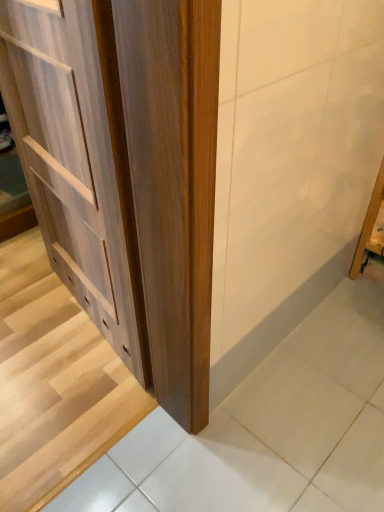
The width and height of the screenshot is (384, 512). What do you see at coordinates (53, 380) in the screenshot? I see `wooden door at center` at bounding box center [53, 380].

Identify the location of wooden door at center. This screenshot has height=512, width=384. (53, 380).

What is the approximate height of light wood cabinet at left?

1.16 meters.

What do you see at coordinates (125, 170) in the screenshot?
I see `light wood cabinet at left` at bounding box center [125, 170].

What are the coordinates of `light wood cabinet at left` in the screenshot? It's located at (125, 170).

At what (x,y) coordinates should I click in order to perform the action: click on wooden door at center. Please return your answer as a coordinate pair (x, y). Image resolution: width=384 pixels, height=512 pixels. Looking at the image, I should click on (53, 380).

Is light wood cabinet at left at the left side of wooden door at center?

In fact, light wood cabinet at left is to the right of wooden door at center.

Who is more distant, light wood cabinet at left or wooden door at center?

wooden door at center is further from the camera.

Which is farther from the camera, (67,86) or (98,389)?

The point (98,389) is behind.

From the image's perspective, is light wood cabinet at left above or below wooden door at center?

light wood cabinet at left is situated higher than wooden door at center in the image.

From a real-world perspective, who is located lower, light wood cabinet at left or wooden door at center?

In real-world perspective, wooden door at center is lower.

Considering the sizes of objects light wood cabinet at left and wooden door at center in the image provided, who is wider, light wood cabinet at left or wooden door at center?

wooden door at center.

Consider the image. Who is shorter, light wood cabinet at left or wooden door at center?

With less height is wooden door at center.

Can you confirm if light wood cabinet at left is bigger than wooden door at center?

Yes.

Is light wood cabinet at left outside of wooden door at center?

light wood cabinet at left lies outside wooden door at center's area.

Is the surface of light wood cabinet at left in direct contact with wooden door at center?

No.

Does light wood cabinet at left turn towards wooden door at center?

Yes.

How many degrees apart are the facing directions of light wood cabinet at left and wooden door at center?

light wood cabinet at left and wooden door at center are facing 99.1 degrees away from each other.

How much distance is there between light wood cabinet at left and wooden door at center?

56.23 centimeters.

I want to click on cupboard that appears above the wooden door at center (from the image's perspective), so click(x=125, y=170).

Considering the positions of objects wooden door at center and light wood cabinet at left in the image provided, who is more to the left, wooden door at center or light wood cabinet at left?

Positioned to the left is wooden door at center.

Is wooden door at center positioned before light wood cabinet at left?

No, the depth of wooden door at center is greater than that of light wood cabinet at left.

Does point (40, 234) come behind point (83, 173)?

Yes, point (40, 234) is farther from viewer.

From the picture: From the image's perspective, which one is positioned lower, wooden door at center or light wood cabinet at left?

wooden door at center.

From a real-world perspective, does wooden door at center sit lower than light wood cabinet at left?

Yes, from a real-world perspective, wooden door at center is below light wood cabinet at left.

Is wooden door at center thinner than light wood cabinet at left?

No.

Does wooden door at center have a greater height compared to light wood cabinet at left?

In fact, wooden door at center may be shorter than light wood cabinet at left.

Does wooden door at center have a smaller size compared to light wood cabinet at left?

Indeed, wooden door at center has a smaller size compared to light wood cabinet at left.

Is wooden door at center positioned beyond the bounds of light wood cabinet at left?

Yes, wooden door at center is outside of light wood cabinet at left.

Is wooden door at center next to light wood cabinet at left?

No, wooden door at center is not in contact with light wood cabinet at left.

Is wooden door at center aimed at light wood cabinet at left?

No, wooden door at center is not oriented towards light wood cabinet at left.

Find the location of a particular element. This screenshot has width=384, height=512. cupboard in front of the wooden door at center is located at coordinates (125, 170).

At what (x,y) coordinates should I click in order to perform the action: click on cupboard on the right of wooden door at center. Please return your answer as a coordinate pair (x, y). Image resolution: width=384 pixels, height=512 pixels. Looking at the image, I should click on (125, 170).

Find the location of a particular element. This screenshot has height=512, width=384. stairwell on the left side of light wood cabinet at left is located at coordinates (53, 380).